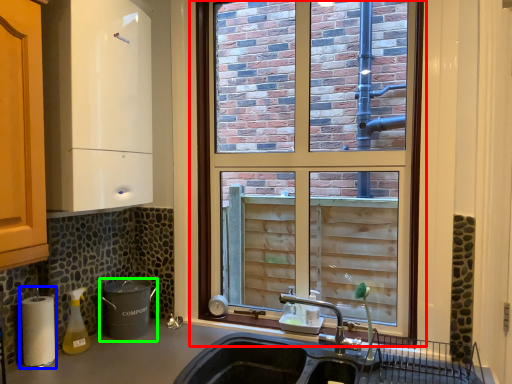
Question: Considering the real-world distances, which object is farthest from window (highlighted by a red box)? appliance (highlighted by a blue box) or appliance (highlighted by a green box)?

Choices:
 (A) appliance
 (B) appliance

Answer: (A)